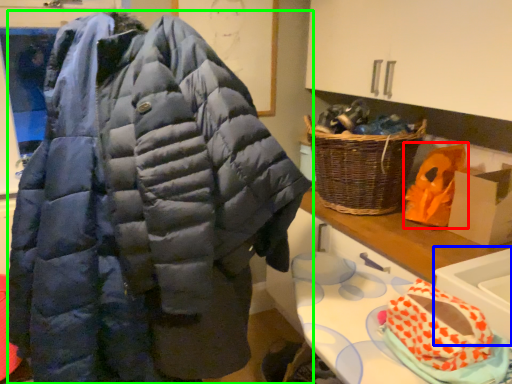
Question: Considering the real-world distances, which object is closest to stuff (highlighted by a red box)? sink (highlighted by a blue box) or jacket (highlighted by a green box).

Choices:
 (A) sink
 (B) jacket

Answer: (A)